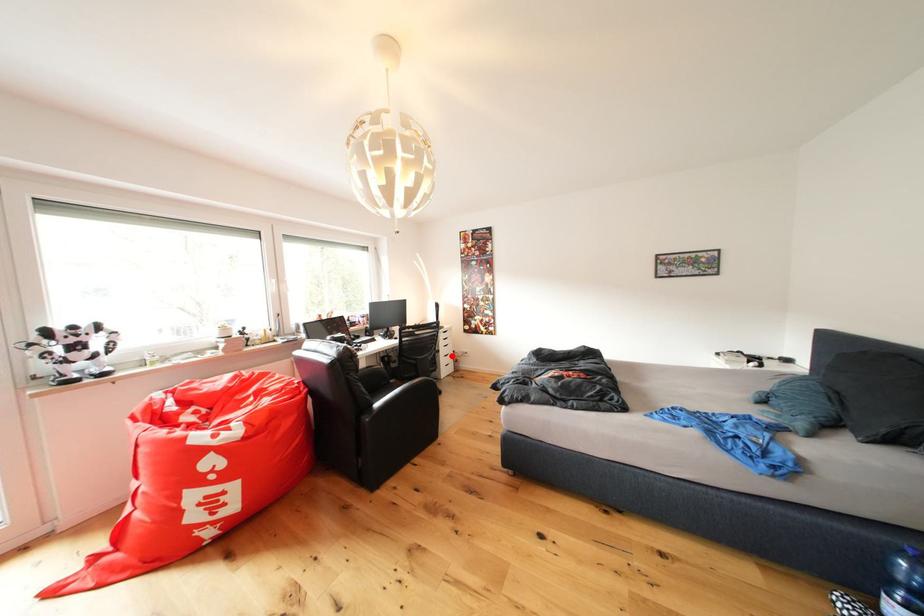
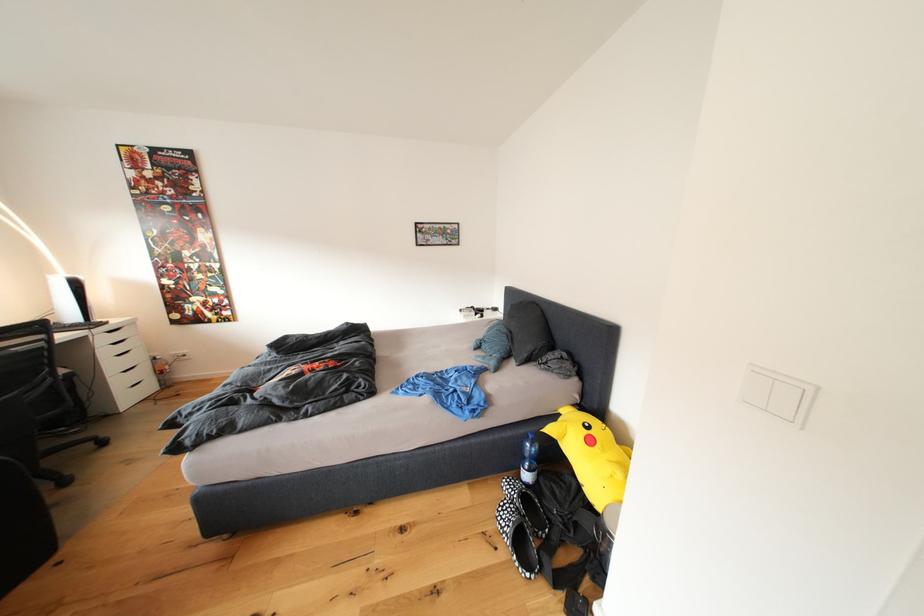
Where in the second image is the point corresponding to the highlighted location from the first image?

(120, 370)